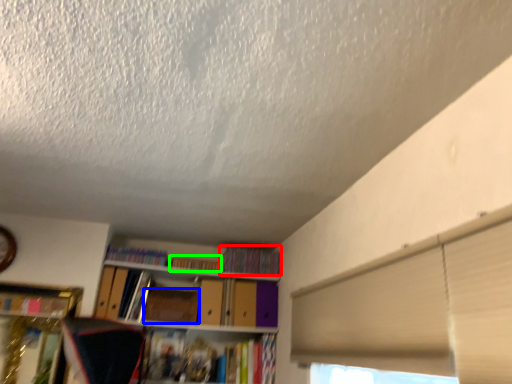
Question: Which object is the farthest from book (highlighted by a red box)? Choose among these: paperback book (highlighted by a blue box) or book (highlighted by a green box).

Choices:
 (A) paperback book
 (B) book

Answer: (A)